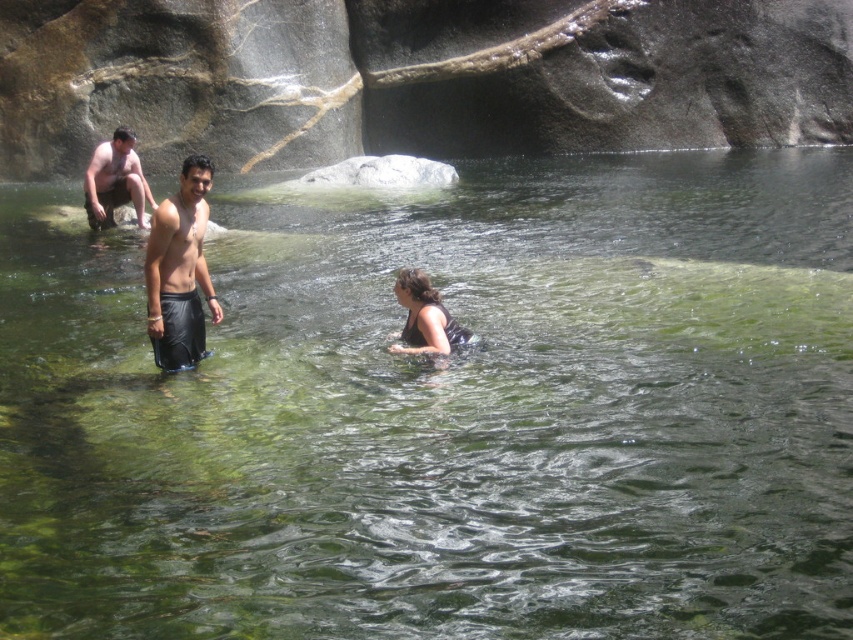
You are a photographer trying to capture the scene with the matte skin man at upper left and the black matte swimsuit at center. Which object should you focus on first if you want to ensure both are in sharp focus?

The matte skin man at upper left is located above the black matte swimsuit at center, so focusing on the matte skin man at upper left first would ensure both are in sharp focus since it is closer to the camera.

You are a photographer trying to capture a shot of the matte skin man at upper left and the black matte shorts at center. Since you want both subjects in focus, which one should you focus on first to ensure the other is also in the frame?

The black matte shorts at center is located below the matte skin man at upper left. To ensure both are in focus, you should focus on the matte skin man at upper left first, as it is closer to the camera, and the shorts being lower in the frame will naturally fall into the depth of field.

From the picture: You are a photographer trying to capture the matte skin man at upper left and the black matte swimsuit at center in a single frame. Based on their sizes, which object should you focus on first to ensure both are in focus?

The matte skin man at upper left is smaller in size compared to the black matte swimsuit at center. To ensure both are in focus, you should focus on the larger object first, which is the black matte swimsuit at center, as it requires more precise focusing due to its size.